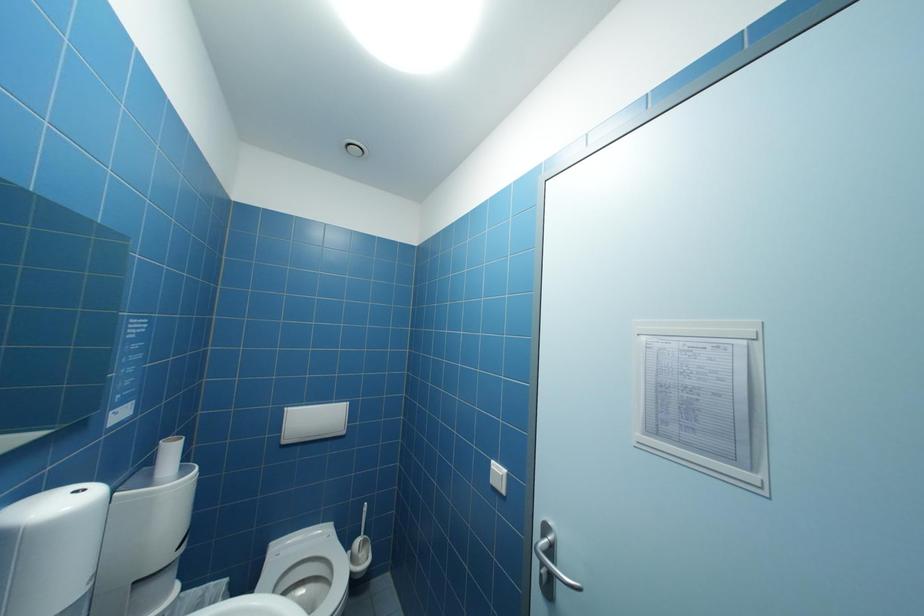
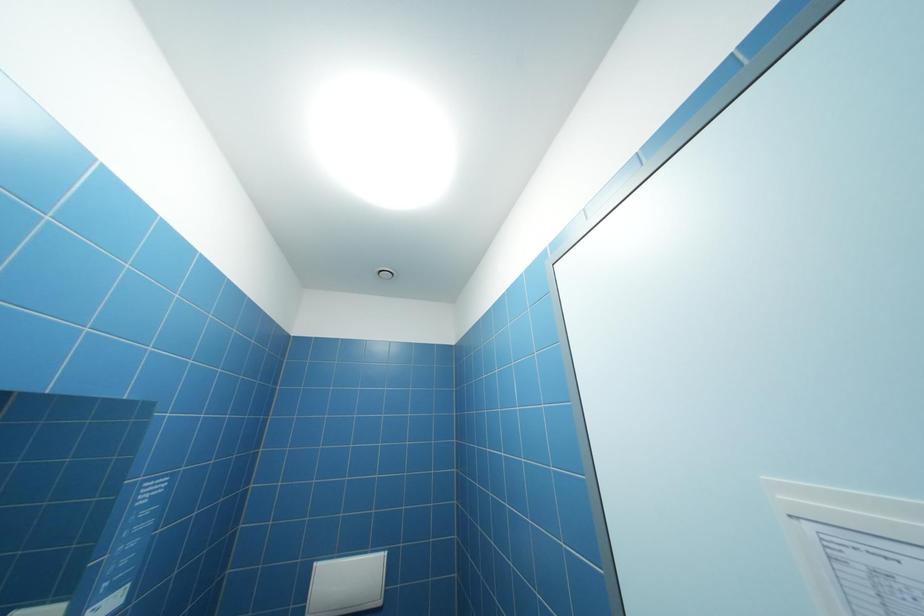
In a continuous first-person perspective shot, in which direction is the camera moving?

The cameraman moved toward right, forward.